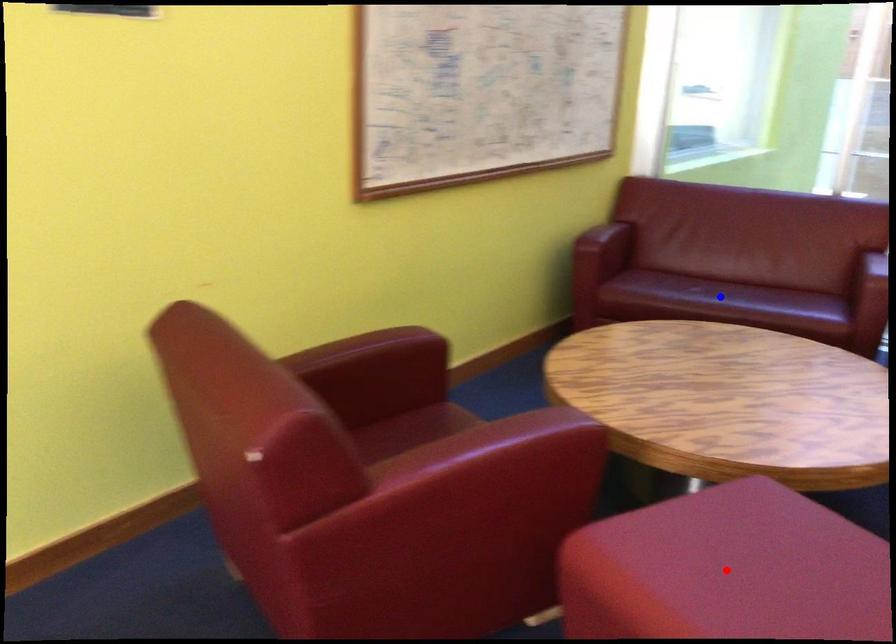
Question: In the image, two points are highlighted. Which point is nearer to the camera? Reply with the corresponding letter.

Choices:
 (A) blue point
 (B) red point

Answer: (B)